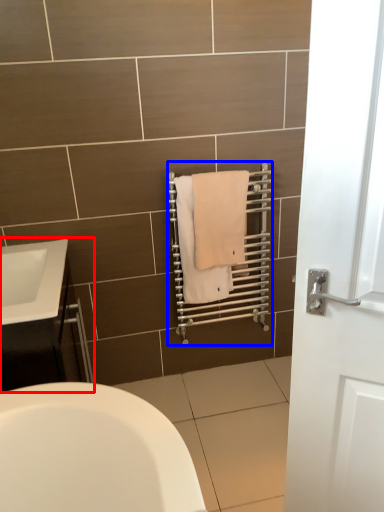
Question: Which of the following is the farthest to the observer, bathroom cabinet (highlighted by a red box) or balustrade (highlighted by a blue box)?

Choices:
 (A) bathroom cabinet
 (B) balustrade

Answer: (B)